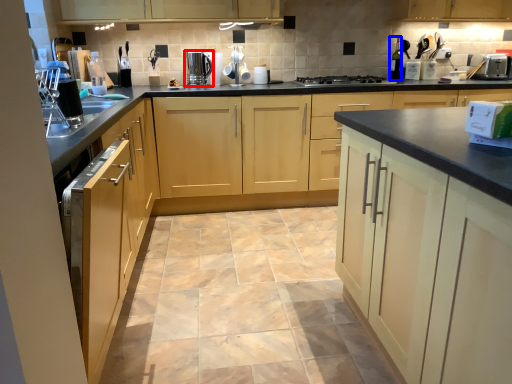
Question: Which object is closer to the camera taking this photo, home appliance (highlighted by a red box) or bottle (highlighted by a blue box)?

Choices:
 (A) home appliance
 (B) bottle

Answer: (A)